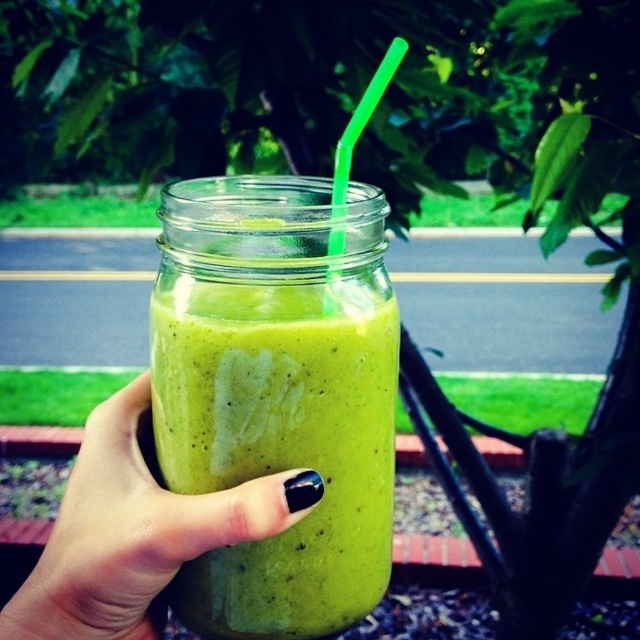
You are designing a packaging label for a new smoothie product. The label must wrap around the green matte glass jar at center and the green matte smoothie at center. What is the minimum width required for the label to cover both objects without overlapping?

The green matte glass jar at center and green matte smoothie at center are 1.25 inches apart, so the label needs to be at least 1.25 inches wide to cover both without overlapping.

You have a green matte glass jar at center and a green matte smoothie at center. Which one has a greater width?

The green matte smoothie at center has a greater width than the green matte glass jar at center.

You are a nutritionist analyzing the image. You need to determine which object is closer to you between the green matte glass jar at center and the green matte smoothie at center. Which one is closer?

The green matte glass jar at center is closer to you than the green matte smoothie at center because the jar is positioned in front of the smoothie.